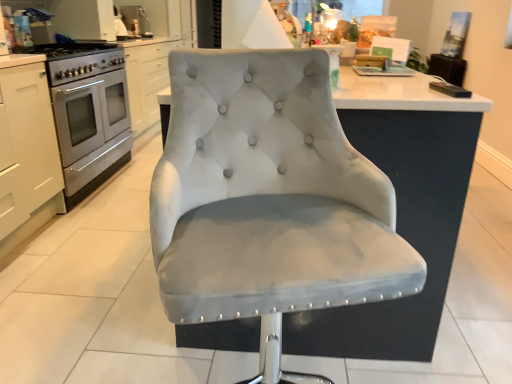
Question: Is suede-like gray chair at center bigger or smaller than satin silver oven at left?

Choices:
 (A) big
 (B) small

Answer: (B)

Question: From a real-world perspective, relative to satin silver oven at left, is suede-like gray chair at center vertically above or below?

Choices:
 (A) above
 (B) below

Answer: (A)

Question: Estimate the real-world distances between objects in this image. Which object is farther from the satin silver oven at left?

Choices:
 (A) suede-like gray chair at center
 (B) white matte cabinet at left
 (C) satin silver gas stove at left

Answer: (A)

Question: Which of these objects is positioned farthest from the white matte cabinet at left?

Choices:
 (A) suede-like gray chair at center
 (B) satin silver oven at left
 (C) satin silver gas stove at left

Answer: (A)